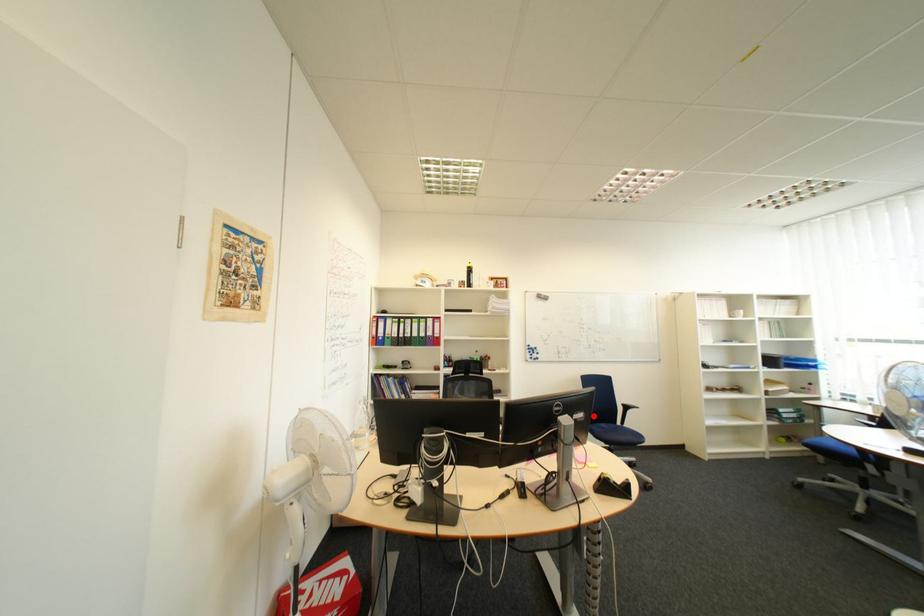
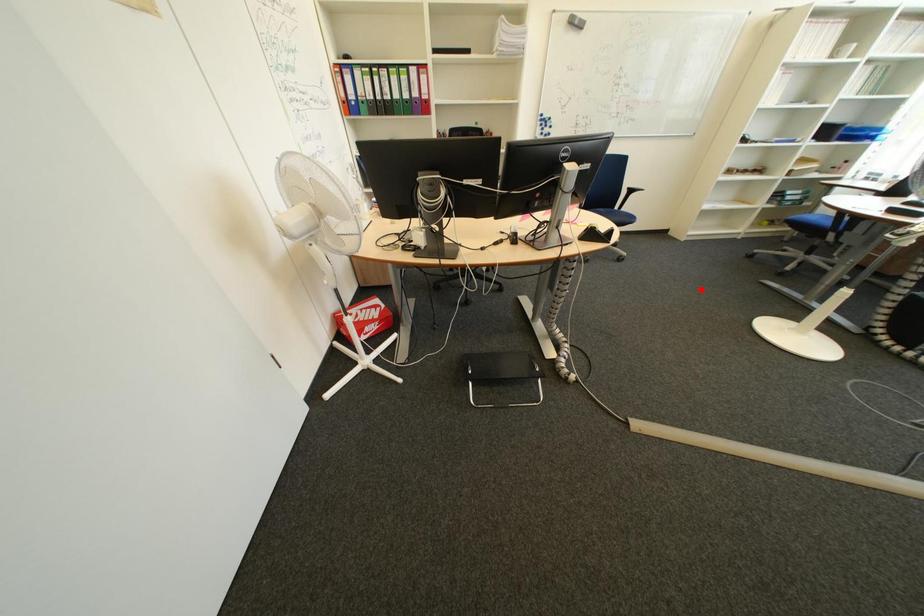
I am providing you with two images of the same scene from different viewpoints. A red point is marked on the first image and another point is marked on the second image. Does the point marked in image1 correspond to the same location as the one in image2?

No